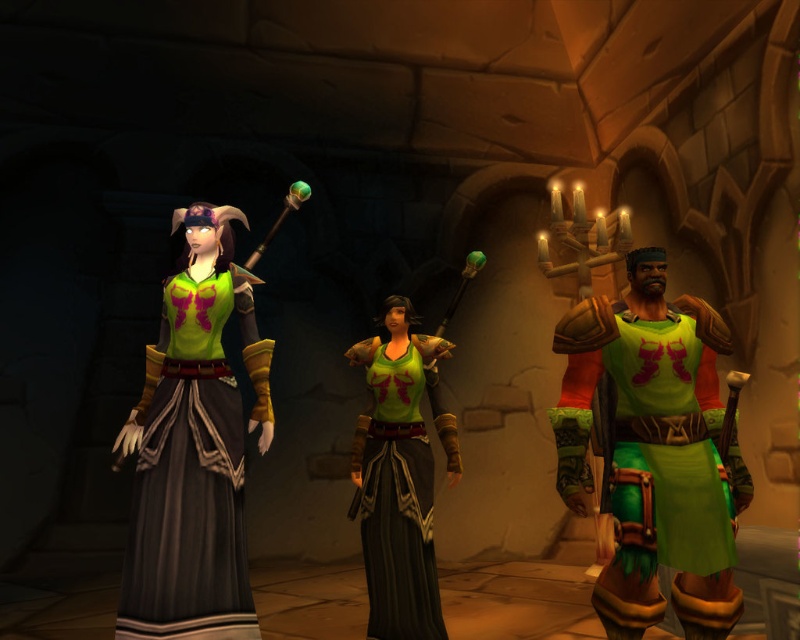
Question: Is green matte dress at center wider than green matte tank top at center?

Choices:
 (A) yes
 (B) no

Answer: (A)

Question: Considering the real-world distances, which object is closest to the green matte tank top at center?

Choices:
 (A) green matte dress at center
 (B) green matte vest at right

Answer: (A)

Question: Which of the following is the closest to the observer?

Choices:
 (A) (404, 554)
 (B) (682, 387)
 (C) (150, 353)

Answer: (B)

Question: Which is nearer to the green matte dress at center?

Choices:
 (A) green matte tank top at center
 (B) green matte vest at right

Answer: (A)

Question: Is green matte vest at right smaller than green matte dress at center?

Choices:
 (A) yes
 (B) no

Answer: (A)

Question: Does green matte vest at right appear over green matte dress at center?

Choices:
 (A) no
 (B) yes

Answer: (B)